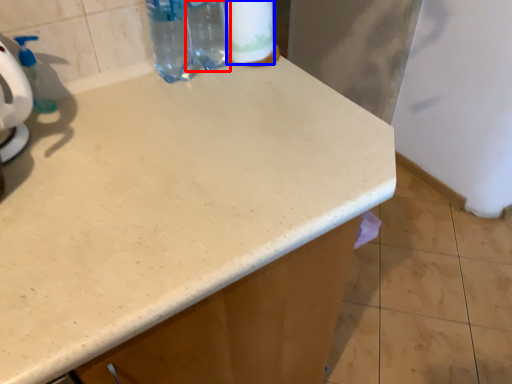
Question: Which point is closer to the camera, bottle (highlighted by a red box) or toilet paper (highlighted by a blue box)?

Choices:
 (A) bottle
 (B) toilet paper

Answer: (B)